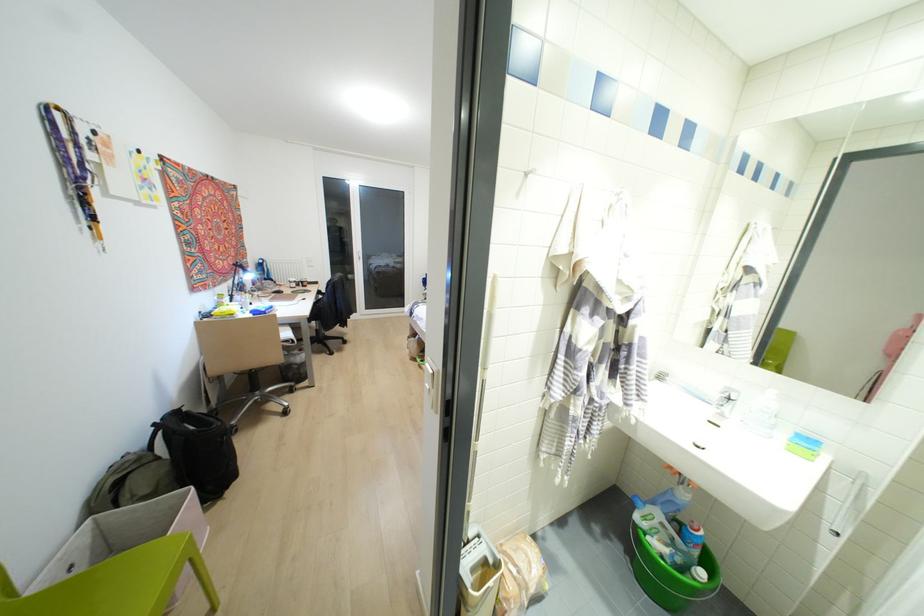
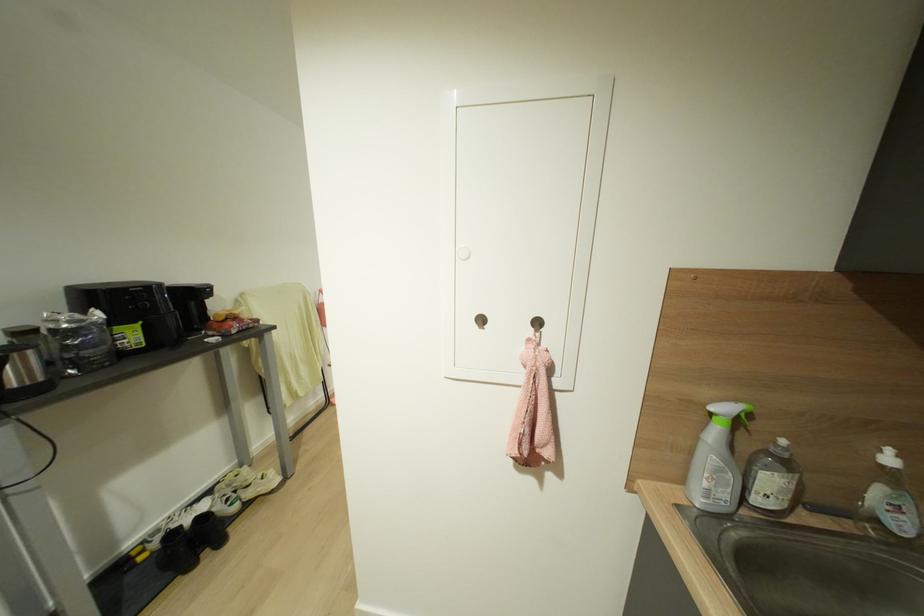
Question: I am providing you with two images of the same scene from different viewpoints. After the viewpoint changes to image2, which objects are now occluded?

Choices:
 (A) black backpack
 (B) white bottle pump
 (C) mirror cabinet door
 (D) soap dispenser pump

Answer: (A)